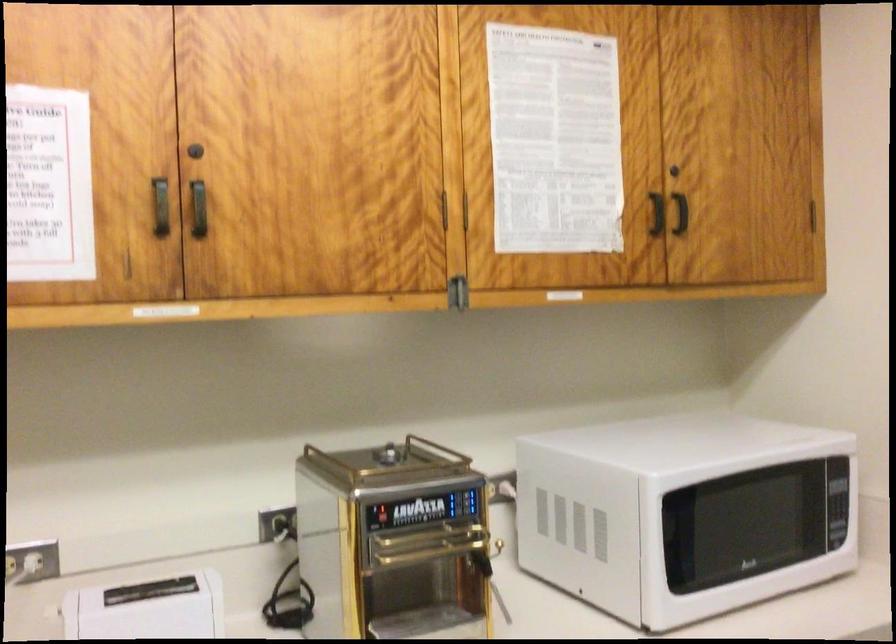
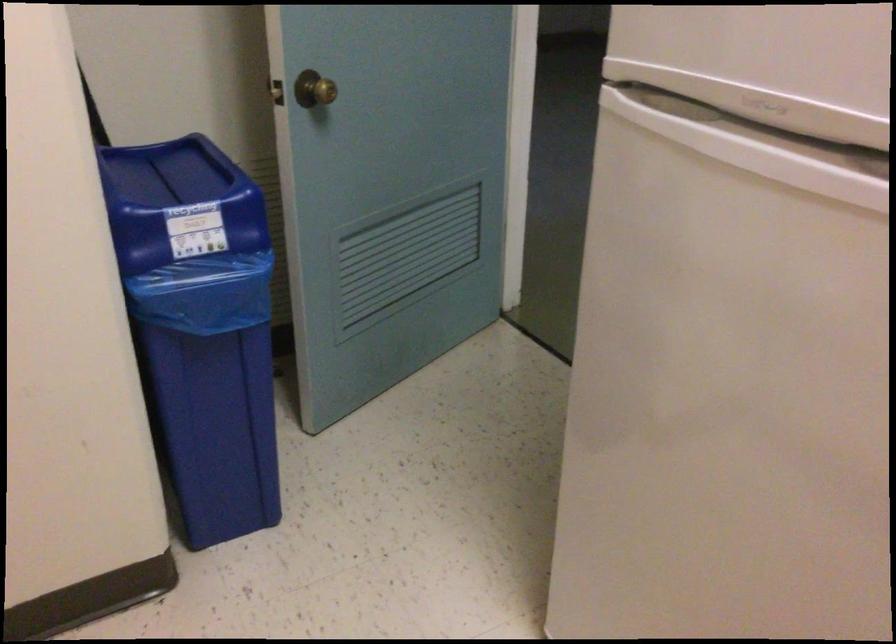
First-person continuous shooting, in which direction is the camera rotating?

The rotation direction of the camera is right-down.